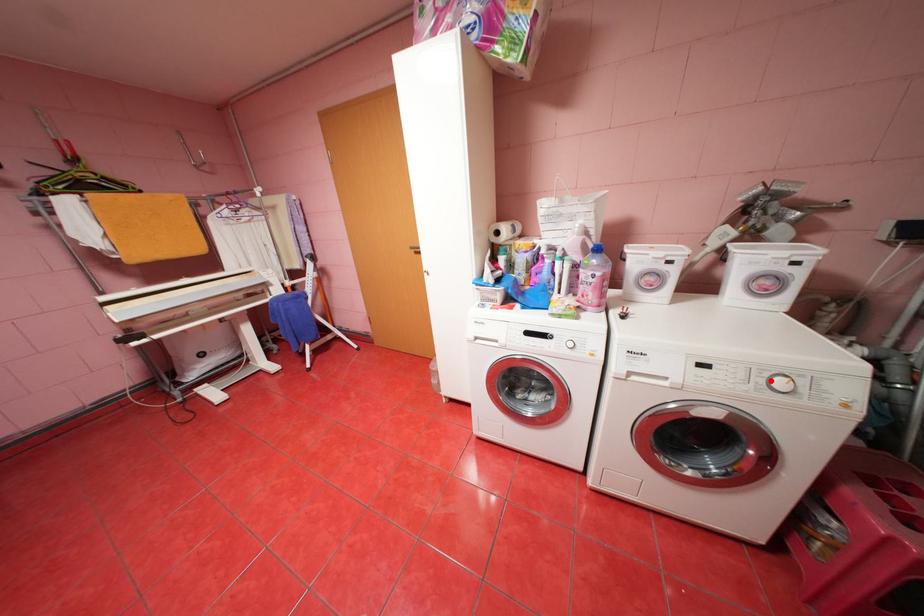
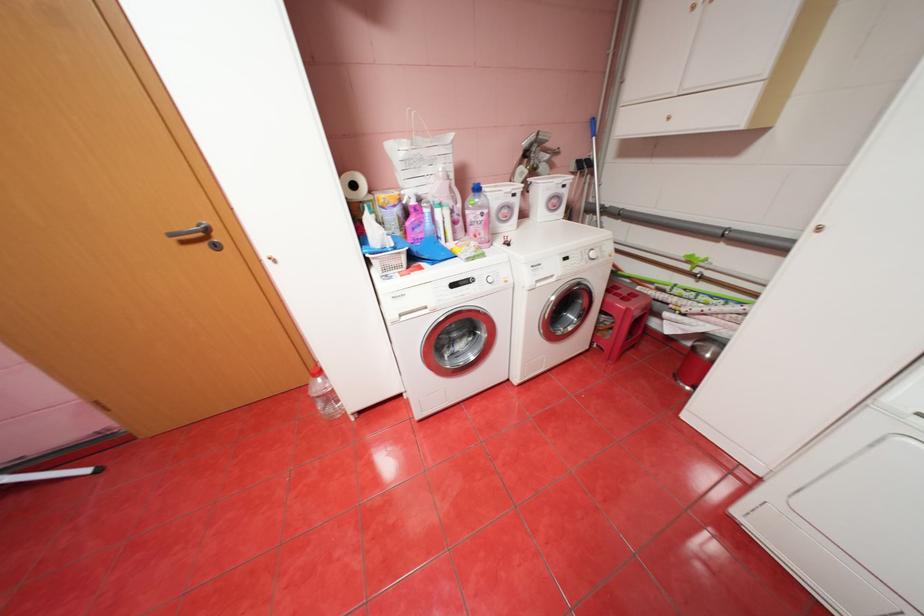
Find the pixel in the second image that matches the highlighted location in the first image.

(596, 256)